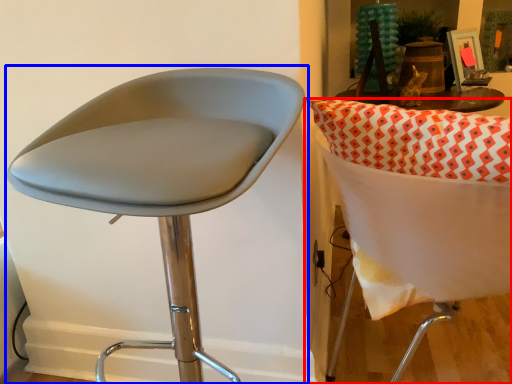
Question: Among these objects, which one is nearest to the camera, chair (highlighted by a red box) or chair (highlighted by a blue box)?

Choices:
 (A) chair
 (B) chair

Answer: (B)